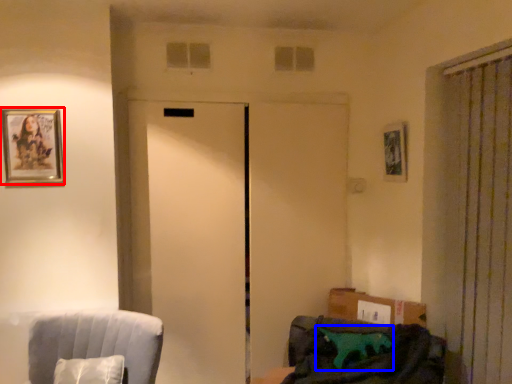
Question: Which of the following is the farthest to the observer, picture frame (highlighted by a red box) or pillow (highlighted by a blue box)?

Choices:
 (A) picture frame
 (B) pillow

Answer: (A)